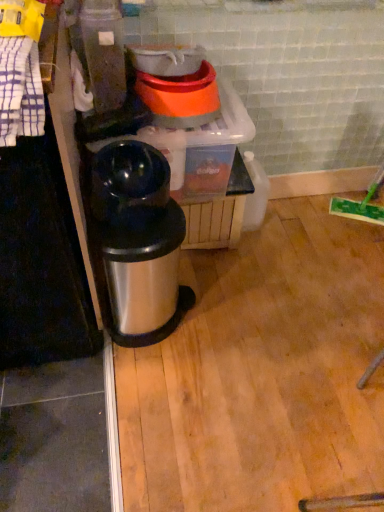
Question: Which direction should I rotate to face shiny black thermos at center, the second appliance in the top-to-bottom sequence, — up or down?

Choices:
 (A) down
 (B) up

Answer: (B)

Question: Is orange plastic bowls at upper center, which ranks as the 1th appliance in top-to-bottom order, wider than shiny black thermos at center, the first appliance positioned from the bottom?

Choices:
 (A) yes
 (B) no

Answer: (A)

Question: Can you confirm if orange plastic bowls at upper center, which ranks as the 1th appliance in top-to-bottom order, is smaller than shiny black thermos at center, the first appliance positioned from the bottom?

Choices:
 (A) no
 (B) yes

Answer: (B)

Question: Can we say orange plastic bowls at upper center, placed as the 2th appliance when sorted from bottom to top, lies outside shiny black thermos at center, the second appliance in the top-to-bottom sequence?

Choices:
 (A) yes
 (B) no

Answer: (A)

Question: From a real-world perspective, is orange plastic bowls at upper center, placed as the 2th appliance when sorted from bottom to top, positioned under shiny black thermos at center, the second appliance in the top-to-bottom sequence, based on gravity?

Choices:
 (A) no
 (B) yes

Answer: (A)

Question: Does orange plastic bowls at upper center, placed as the 2th appliance when sorted from bottom to top, have a greater height compared to shiny black thermos at center, the second appliance in the top-to-bottom sequence?

Choices:
 (A) no
 (B) yes

Answer: (A)

Question: Does orange plastic bowls at upper center, which ranks as the 1th appliance in top-to-bottom order, have a lesser width compared to shiny black thermos at center, the second appliance in the top-to-bottom sequence?

Choices:
 (A) no
 (B) yes

Answer: (A)

Question: Can you confirm if shiny black thermos at center, the first appliance positioned from the bottom, is smaller than orange plastic bowls at upper center, which ranks as the 1th appliance in top-to-bottom order?

Choices:
 (A) yes
 (B) no

Answer: (B)

Question: Is shiny black thermos at center, the first appliance positioned from the bottom, closer to camera compared to orange plastic bowls at upper center, placed as the 2th appliance when sorted from bottom to top?

Choices:
 (A) yes
 (B) no

Answer: (A)

Question: Does shiny black thermos at center, the first appliance positioned from the bottom, come behind orange plastic bowls at upper center, placed as the 2th appliance when sorted from bottom to top?

Choices:
 (A) yes
 (B) no

Answer: (B)

Question: Does shiny black thermos at center, the first appliance positioned from the bottom, have a larger size compared to orange plastic bowls at upper center, which ranks as the 1th appliance in top-to-bottom order?

Choices:
 (A) no
 (B) yes

Answer: (B)

Question: Is shiny black thermos at center, the second appliance in the top-to-bottom sequence, wider than orange plastic bowls at upper center, which ranks as the 1th appliance in top-to-bottom order?

Choices:
 (A) yes
 (B) no

Answer: (B)

Question: Is shiny black thermos at center, the second appliance in the top-to-bottom sequence, positioned with its back to orange plastic bowls at upper center, placed as the 2th appliance when sorted from bottom to top?

Choices:
 (A) yes
 (B) no

Answer: (A)

Question: From the image's perspective, is shiny metallic trash can at center above shiny black thermos at center, the second appliance in the top-to-bottom sequence?

Choices:
 (A) yes
 (B) no

Answer: (B)